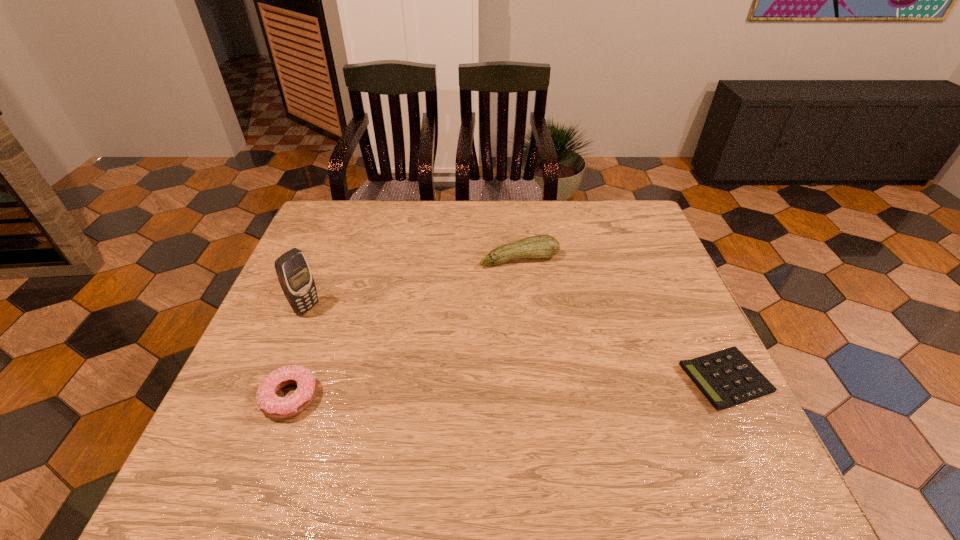
Where is `vacant space located on the front face of the tallest object`? This screenshot has height=540, width=960. vacant space located on the front face of the tallest object is located at coordinates (412, 366).

This screenshot has width=960, height=540. Find the location of `vacant space situated on the front face of the tallest object`. vacant space situated on the front face of the tallest object is located at coordinates (359, 338).

In order to click on vacant point located 0.350m at the stem end of the farthest object in this screenshot , I will do `click(573, 369)`.

Identify the location of blank area located 0.150m at the stem end of the farthest object. This screenshot has height=540, width=960. (545, 307).

What are the coordinates of `vacant space located at the stem end of the farthest object` in the screenshot? It's located at (539, 291).

Identify the location of doughnut located in the near edge section of the desktop. (269, 403).

The image size is (960, 540). I want to click on calculator that is at the near edge, so click(x=727, y=378).

Locate an element on the screen. doughnut at the left edge is located at coordinates coord(269,403).

Where is `cellular telephone that is at the left edge`? cellular telephone that is at the left edge is located at coordinates (295, 277).

I want to click on object at the right edge, so click(727, 378).